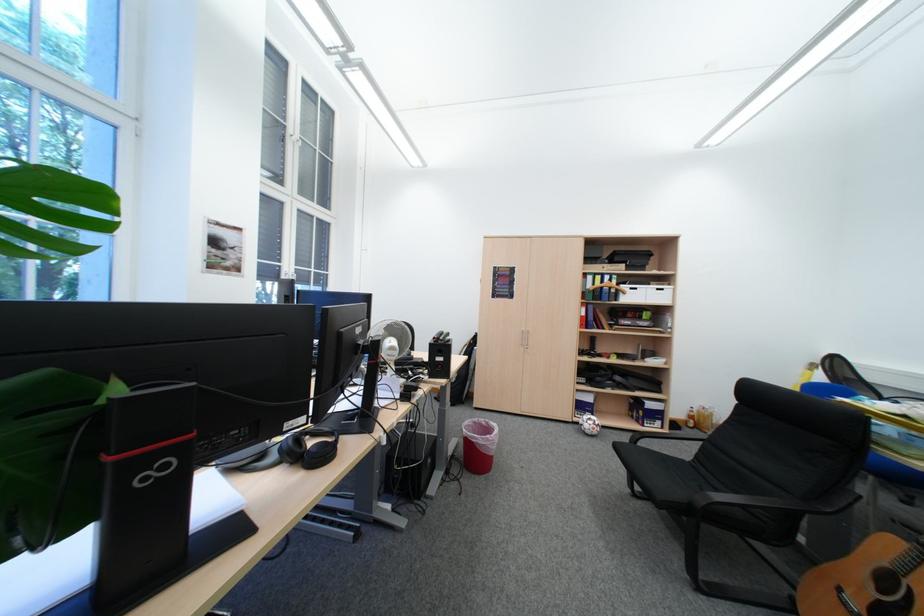
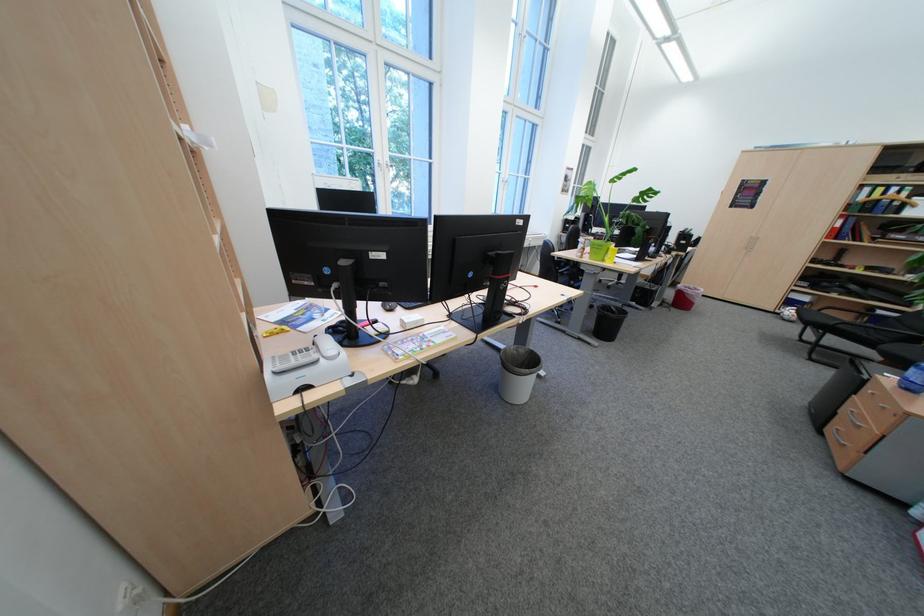
Find the pixel in the second image that matches (x=597, y=276) in the first image.

(873, 188)